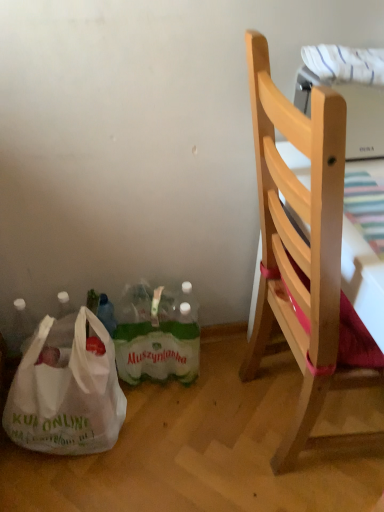
The width and height of the screenshot is (384, 512). Describe the element at coordinates (157, 335) in the screenshot. I see `green plastic bottles at lower center` at that location.

This screenshot has height=512, width=384. What do you see at coordinates (66, 396) in the screenshot? I see `white plastic bag at lower left` at bounding box center [66, 396].

At what (x,y) coordinates should I click in order to perform the action: click on natural wood chair at right. Please return your answer as a coordinate pair (x, y). The image size is (384, 512). Looking at the image, I should click on (303, 253).

Is natural wood chair at right to the left of green plastic bottles at lower center from the viewer's perspective?

No.

Is natural wood chair at right turned away from green plastic bottles at lower center?

No.

Is natural wood chair at right not inside green plastic bottles at lower center?

That's correct, natural wood chair at right is outside of green plastic bottles at lower center.

Consider the image. Which is behind, natural wood chair at right or green plastic bottles at lower center?

green plastic bottles at lower center is further from the camera.

Between white plastic bag at lower left and natural wood chair at right, which one is positioned in front?

natural wood chair at right is in front.

Which of these two, white plastic bag at lower left or natural wood chair at right, is bigger?

natural wood chair at right.

Would you say natural wood chair at right is part of white plastic bag at lower left's contents?

Actually, natural wood chair at right is outside white plastic bag at lower left.

In the image, is white plastic bag at lower left on the left side or the right side of natural wood chair at right?

In the image, white plastic bag at lower left appears on the left side of natural wood chair at right.

Between green plastic bottles at lower center and natural wood chair at right, which one has smaller size?

With smaller size is green plastic bottles at lower center.

Between green plastic bottles at lower center and natural wood chair at right, which one has smaller width?

green plastic bottles at lower center.

Which is behind, point (153, 374) or point (276, 152)?

The point (153, 374) is behind.

Is the position of green plastic bottles at lower center more distant than that of natural wood chair at right?

Yes, green plastic bottles at lower center is further from the camera.

Is point (170, 318) farther from camera compared to point (59, 416)?

Yes, point (170, 318) is behind point (59, 416).

Measure the distance from green plastic bottles at lower center to white plastic bag at lower left.

A distance of 7.84 inches exists between green plastic bottles at lower center and white plastic bag at lower left.

Is green plastic bottles at lower center aimed at white plastic bag at lower left?

No, green plastic bottles at lower center is not oriented towards white plastic bag at lower left.

Where is `bottle above the white plastic bag at lower left (from the image's perspective)`? The image size is (384, 512). bottle above the white plastic bag at lower left (from the image's perspective) is located at coordinates (157, 335).

Would you consider natural wood chair at right to be distant from white plastic bag at lower left?

natural wood chair at right is near white plastic bag at lower left, not far away.

The width and height of the screenshot is (384, 512). I want to click on chair above the white plastic bag at lower left (from the image's perspective), so click(303, 253).

Which is in front, point (268, 249) or point (44, 441)?

Point (268, 249)

What's the angular difference between natural wood chair at right and white plastic bag at lower left's facing directions?

The facing directions of natural wood chair at right and white plastic bag at lower left are 103 degrees apart.

From a real-world perspective, between white plastic bag at lower left and green plastic bottles at lower center, who is vertically higher?

white plastic bag at lower left, from a real-world perspective.

Where is `bottle located above the white plastic bag at lower left (from the image's perspective)`? bottle located above the white plastic bag at lower left (from the image's perspective) is located at coordinates (157, 335).

Considering the sizes of objects white plastic bag at lower left and green plastic bottles at lower center in the image provided, who is bigger, white plastic bag at lower left or green plastic bottles at lower center?

white plastic bag at lower left is bigger.

Identify the location of bottle lying behind the natural wood chair at right. This screenshot has height=512, width=384. (157, 335).

At what (x,y) coordinates should I click in order to perform the action: click on chair in front of the white plastic bag at lower left. Please return your answer as a coordinate pair (x, y). Looking at the image, I should click on (303, 253).

When comparing their distances from green plastic bottles at lower center, does natural wood chair at right or white plastic bag at lower left seem further?

natural wood chair at right is positioned further to the anchor green plastic bottles at lower center.

Which object lies nearer to the anchor point natural wood chair at right, green plastic bottles at lower center or white plastic bag at lower left?

green plastic bottles at lower center.

From the picture: Based on their spatial positions, is white plastic bag at lower left or green plastic bottles at lower center further from natural wood chair at right?

white plastic bag at lower left is further to natural wood chair at right.

Considering their positions, is white plastic bag at lower left positioned further to green plastic bottles at lower center than natural wood chair at right?

natural wood chair at right lies further to green plastic bottles at lower center than the other object.

When comparing their distances from white plastic bag at lower left, does green plastic bottles at lower center or natural wood chair at right seem further?

Based on the image, natural wood chair at right appears to be further to white plastic bag at lower left.

Looking at the image, which one is located closer to white plastic bag at lower left, natural wood chair at right or green plastic bottles at lower center?

Among the two, green plastic bottles at lower center is located nearer to white plastic bag at lower left.

Find the location of a particular element. bottle situated between white plastic bag at lower left and natural wood chair at right from left to right is located at coordinates (157, 335).